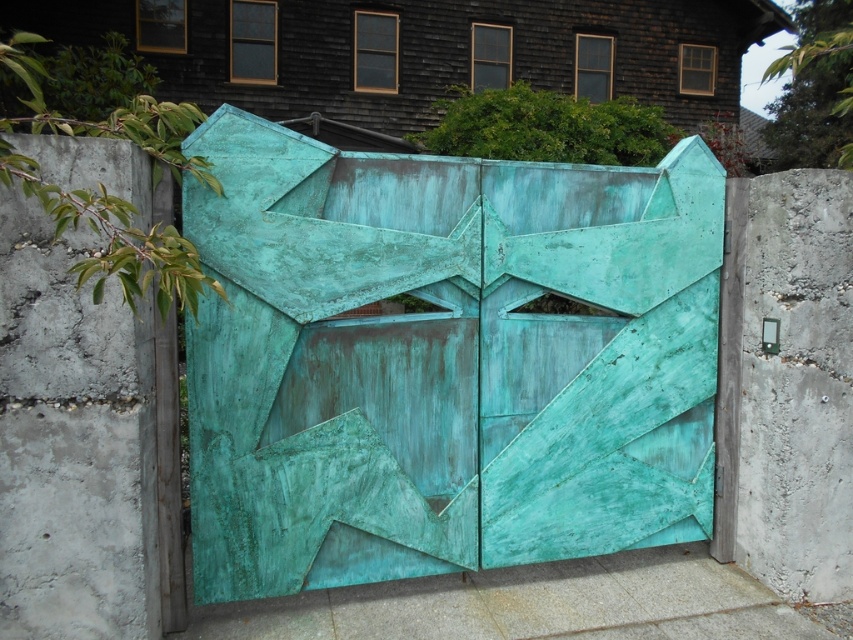
You are standing in front of the gate and notice a specific point on the left side of the gate. Which object from the scene corresponds to the coordinates point (73, 442)?

The coordinates point (73, 442) corresponds to the green patina concrete at left.

You are standing in front of the gate and want to walk from the point marked as point (131, 378) to the point marked as point (550, 589). Which direction should you move relative to the gate?

You should move towards the back of the gate because point (131, 378) is in front of point (550, 589).

You are standing in front of the gate and want to place a small potted plant on the closest surface. Which surface should you choose between the green patina concrete at left and the smooth concrete slab at bottom center?

The green patina concrete at left is closer to the viewer than the smooth concrete slab at bottom center, so you should place the potted plant on the green patina concrete at left.